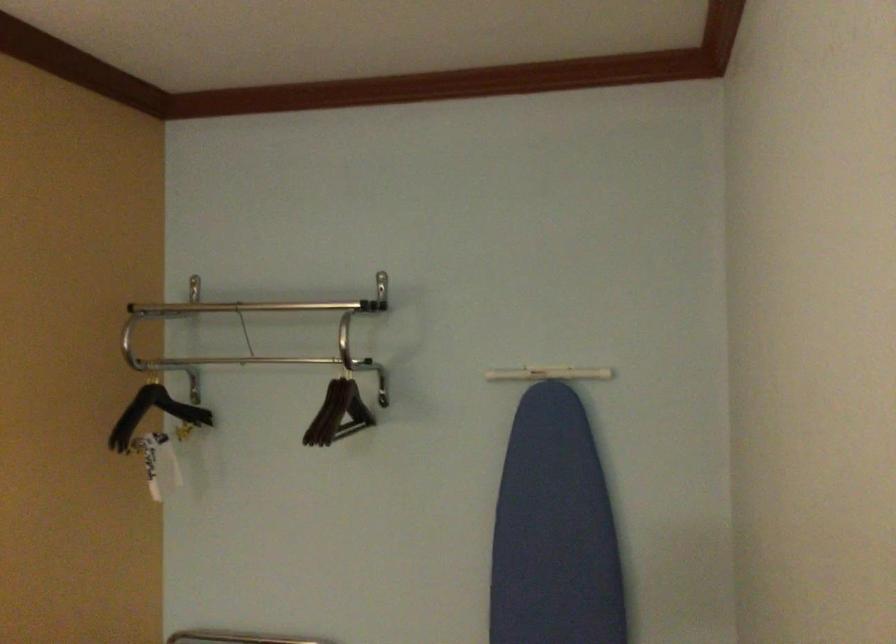
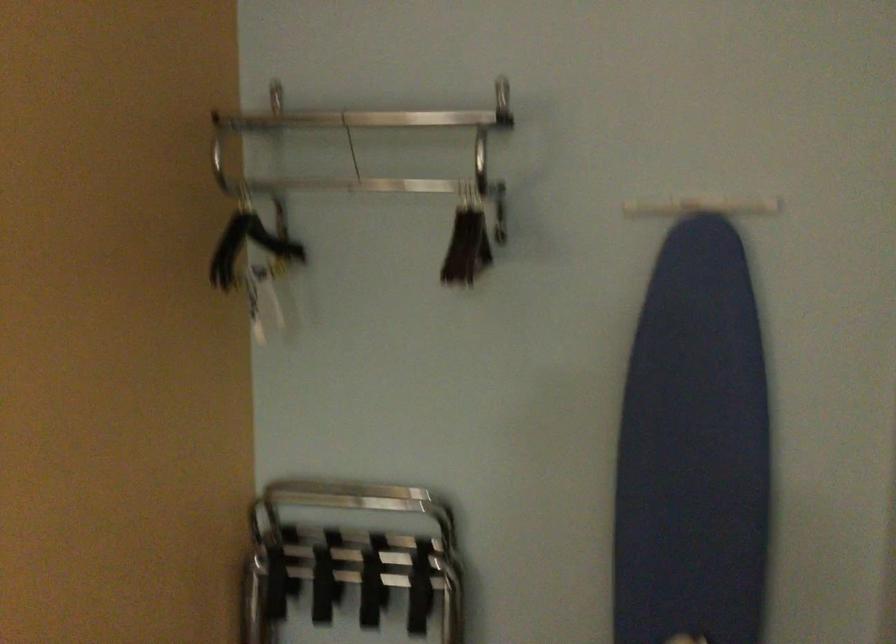
The images are taken continuously from a first-person perspective. In which direction are you moving?

The cameraman walked toward left, forward.